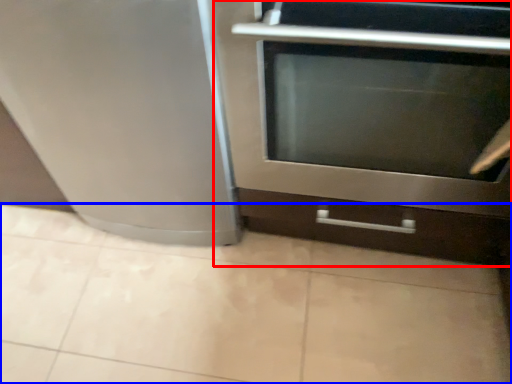
Question: Which object appears closest to the camera in this image, oven (highlighted by a red box) or ceramic tile (highlighted by a blue box)?

Choices:
 (A) oven
 (B) ceramic tile

Answer: (A)